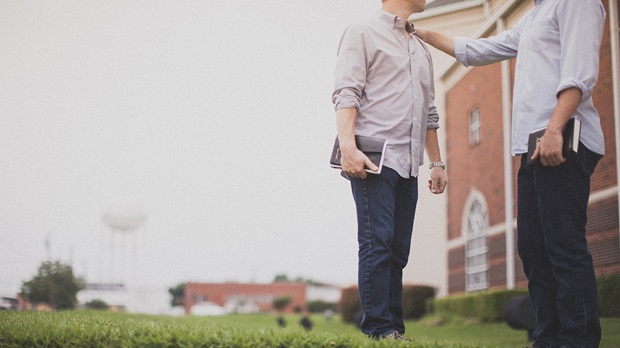
You are a GUI agent. You are given a task and a screenshot of the screen. Output one action in this format:
    pyautogui.click(x=<x>, y=<y>)
    Task: Click on the windows
    Image resolution: width=620 pixels, height=348 pixels.
    Given the screenshot: What is the action you would take?
    pyautogui.click(x=477, y=262), pyautogui.click(x=475, y=216), pyautogui.click(x=472, y=126)